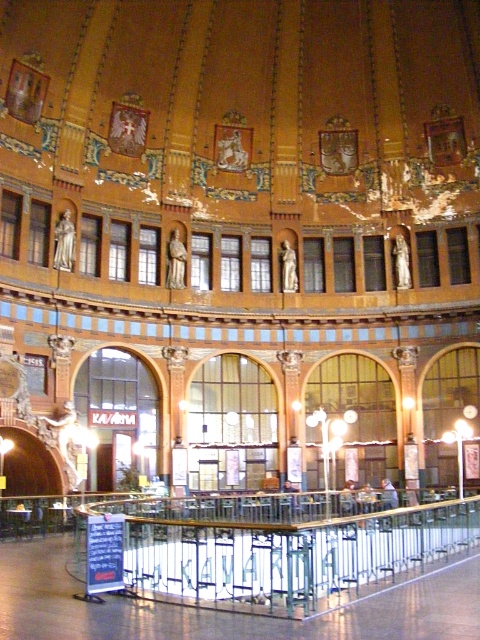
Consider the image. You are standing in the grand building and want to reach the metallic glass balustrade at center. Based on the coordinates provided, which direction should you move from your current position at point (x=279, y=554)?

The point (x=279, y=554) already indicates the location of the metallic glass balustrade at center, so you are already at the desired location.

You are an interior designer planning to place a large decorative item in this space. You have two options from the image, the metallic glass balustrade at center and the silver metallic statue at center. Which one is larger and would require more space?

The metallic glass balustrade at center is bigger than the silver metallic statue at center, so it would require more space.